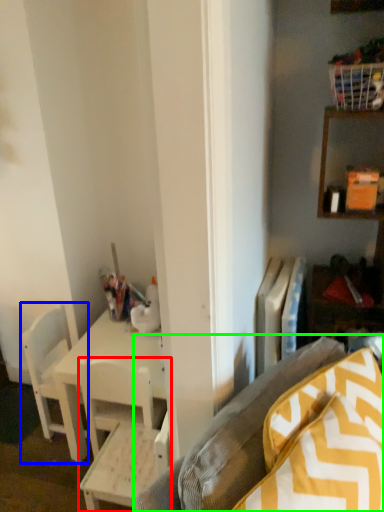
Question: Which is nearer to the chair (highlighted by a red box)? chair (highlighted by a blue box) or studio couch (highlighted by a green box).

Choices:
 (A) chair
 (B) studio couch

Answer: (A)